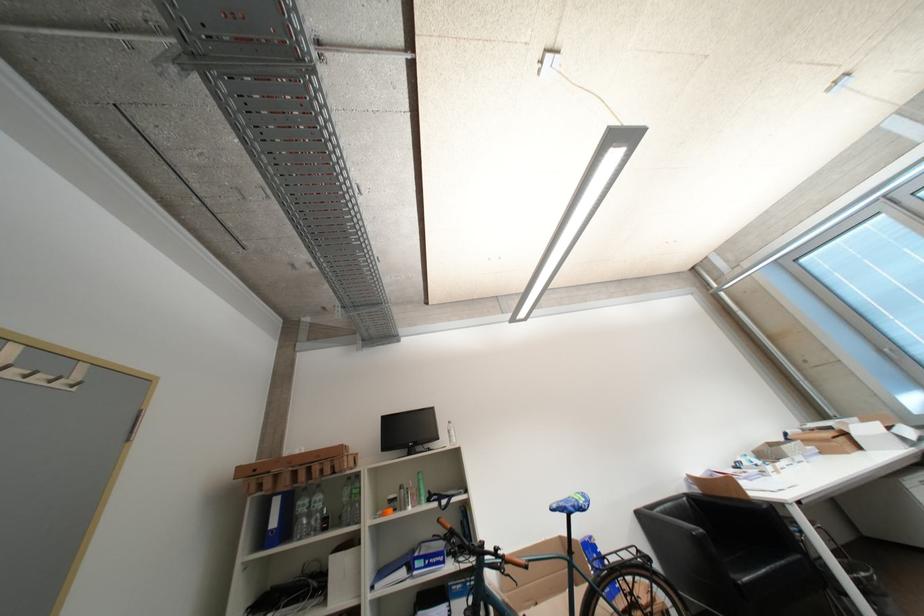
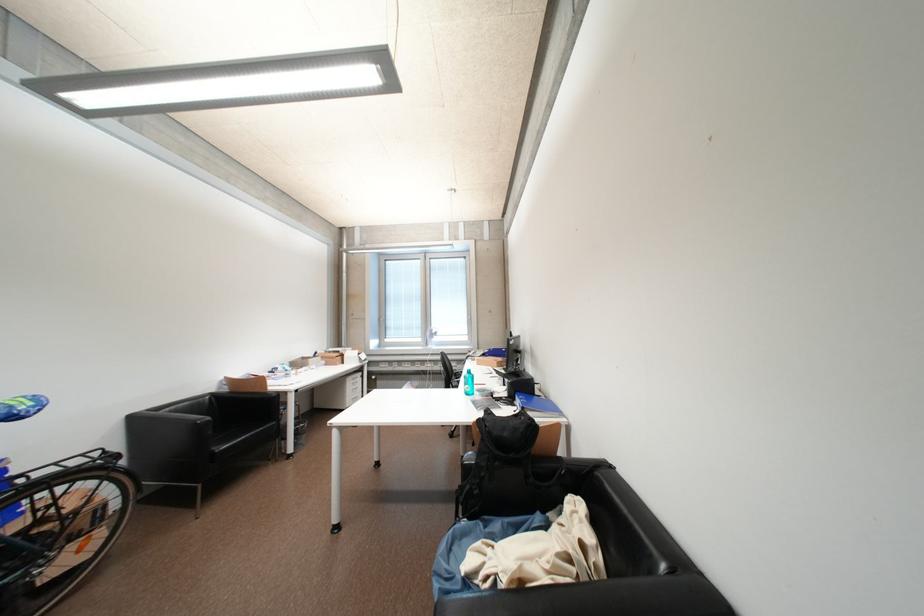
Find the pixel in the second image that matches (834,442) in the first image.

(341, 360)